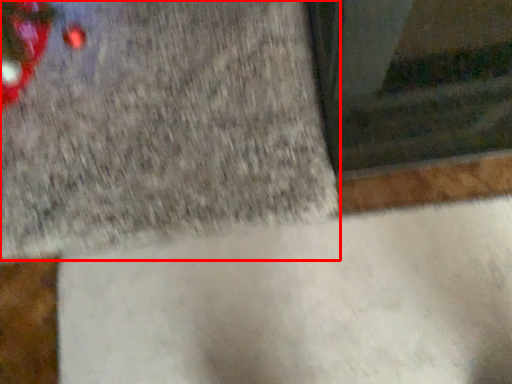
Question: From the image's perspective, where is concrete (annotated by the red box) located relative to concrete?

Choices:
 (A) below
 (B) above

Answer: (B)